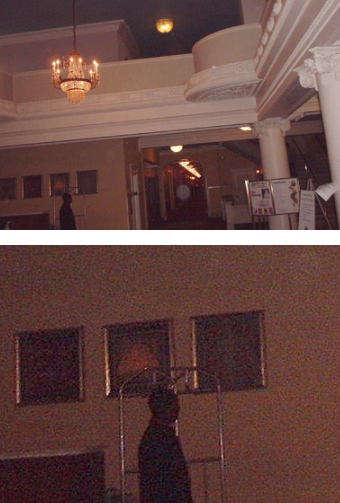
Find the location of a particular element. The image size is (340, 503). pillars is located at coordinates (281, 150), (335, 104).